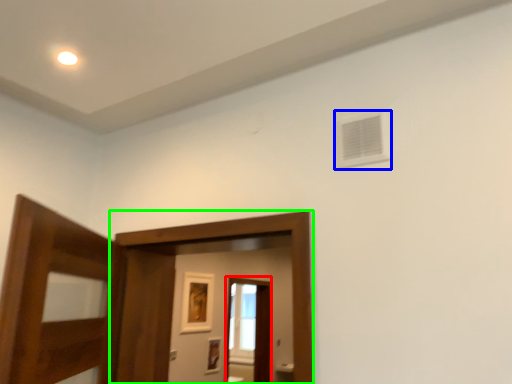
Question: Estimate the real-world distances between objects in this image. Which object is closer to screen door (highlighted by a red box), air conditioning (highlighted by a blue box) or screen door (highlighted by a green box)?

Choices:
 (A) air conditioning
 (B) screen door

Answer: (B)